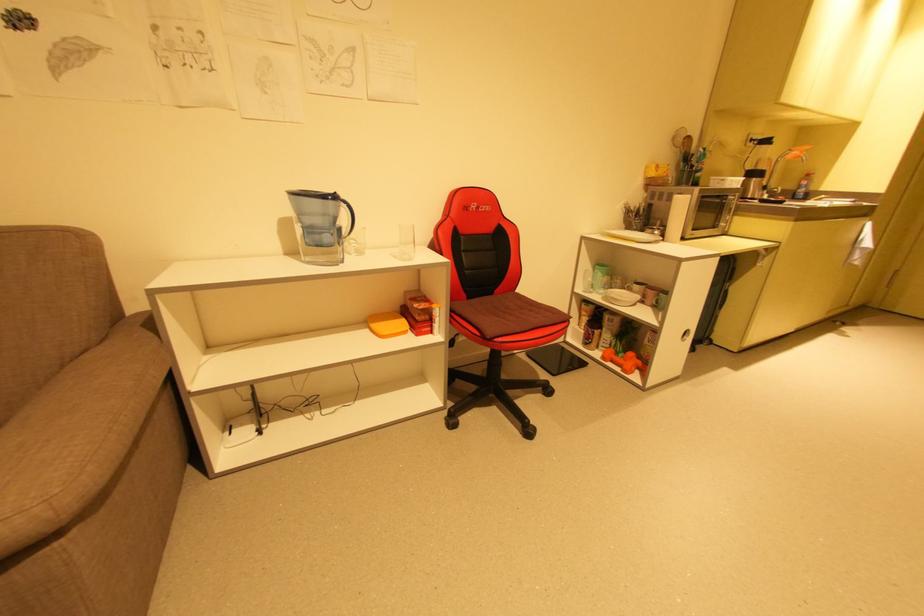
Find where to resting arm the sofa armrest. Please return your answer as a coordinate pair (x, y).

(49, 244)